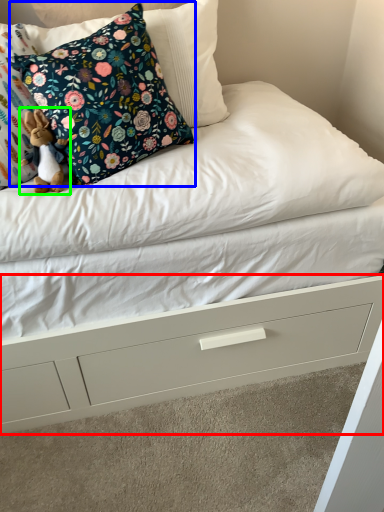
Question: Which object is the farthest from drawer (highlighted by a red box)? Choose among these: pillow (highlighted by a blue box) or toy (highlighted by a green box).

Choices:
 (A) pillow
 (B) toy

Answer: (B)